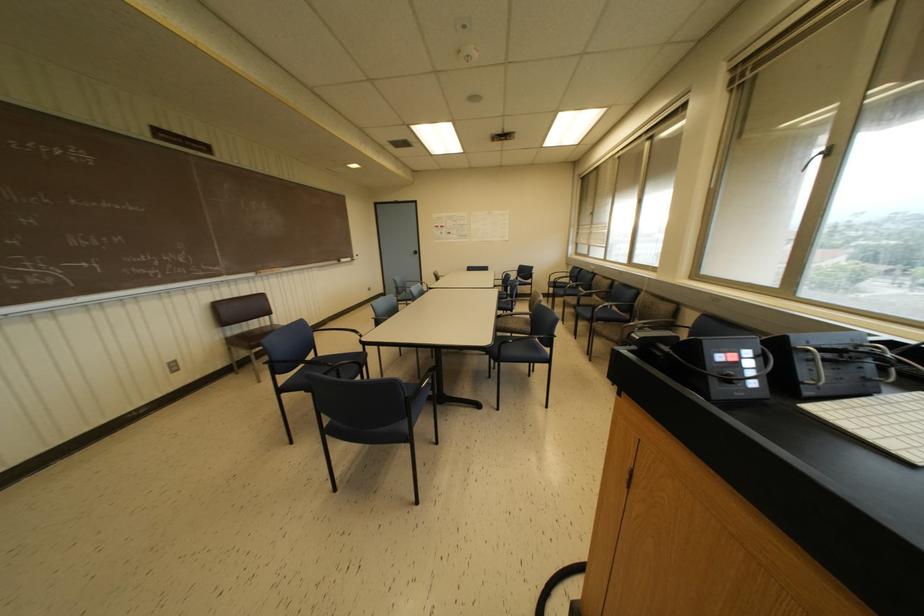
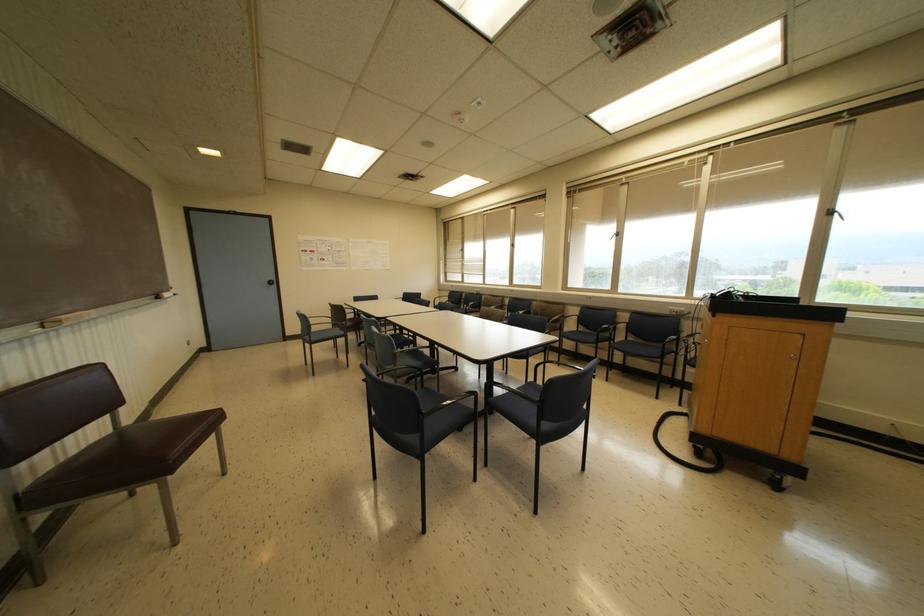
Question: I am providing you with two images of the same scene from different viewpoints. Which of the following objects are not visible in image2?

Choices:
 (A) black window crank
 (B) brown chair sitting surface
 (C) white control button
 (D) clear plastic case

Answer: (C)